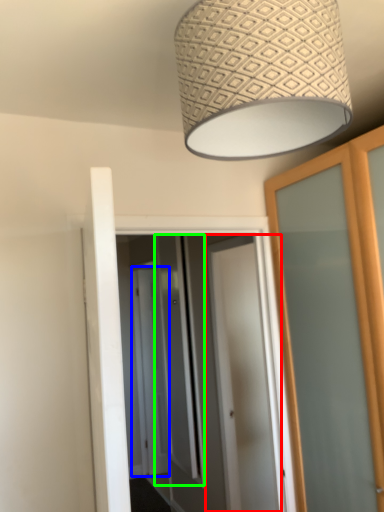
Question: Estimate the real-world distances between objects in this image. Which object is farther from door (highlighted by a red box), screen door (highlighted by a blue box) or screen door (highlighted by a green box)?

Choices:
 (A) screen door
 (B) screen door

Answer: (A)